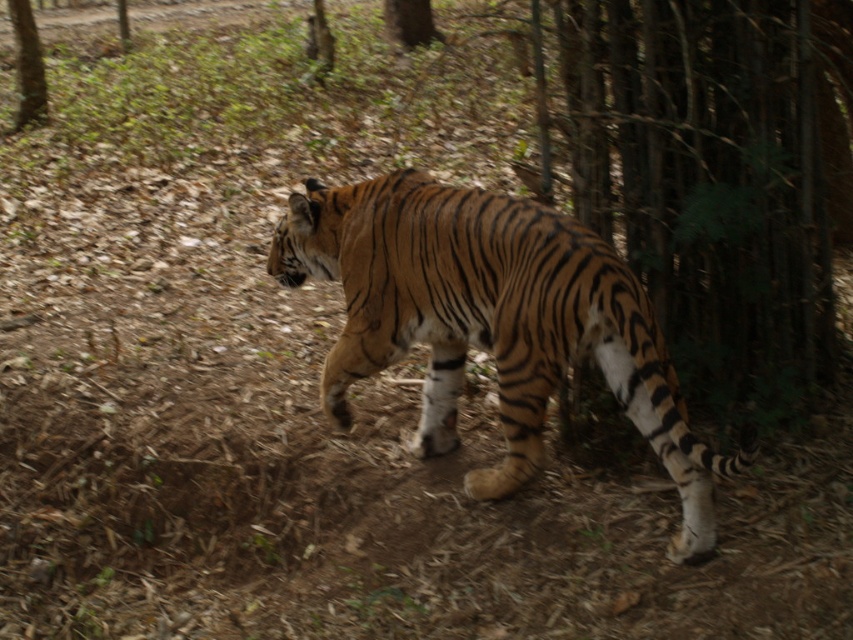
Between orange-brown striped tiger at center and brown textured tree at upper left, which one has more height?

orange-brown striped tiger at center is taller.

Does point (403, 320) lie in front of point (24, 65)?

That is True.

Between point (560, 372) and point (33, 90), which one is positioned behind?

The point (33, 90) is behind.

Where is `orange-brown striped tiger at center`? The image size is (853, 640). orange-brown striped tiger at center is located at coordinates (490, 321).